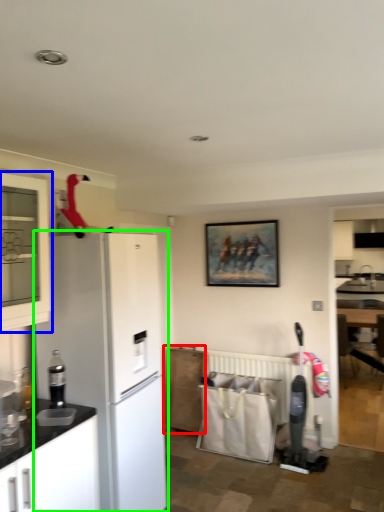
Question: Which object is the closest to the cabinetry (highlighted by a red box)? Choose among these: cabinetry (highlighted by a blue box) or refrigerator (highlighted by a green box).

Choices:
 (A) cabinetry
 (B) refrigerator

Answer: (B)